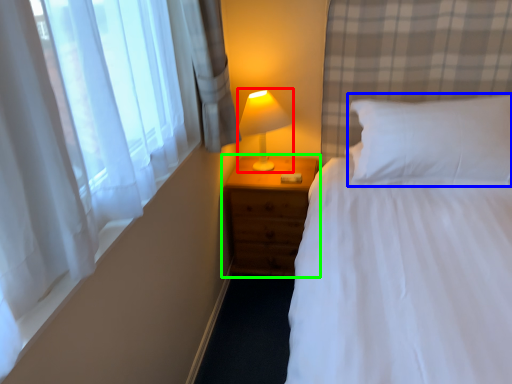
Question: Which object is positioned closest to lamp (highlighted by a red box)? Select from pillow (highlighted by a blue box) and nightstand (highlighted by a green box).

Choices:
 (A) pillow
 (B) nightstand

Answer: (B)